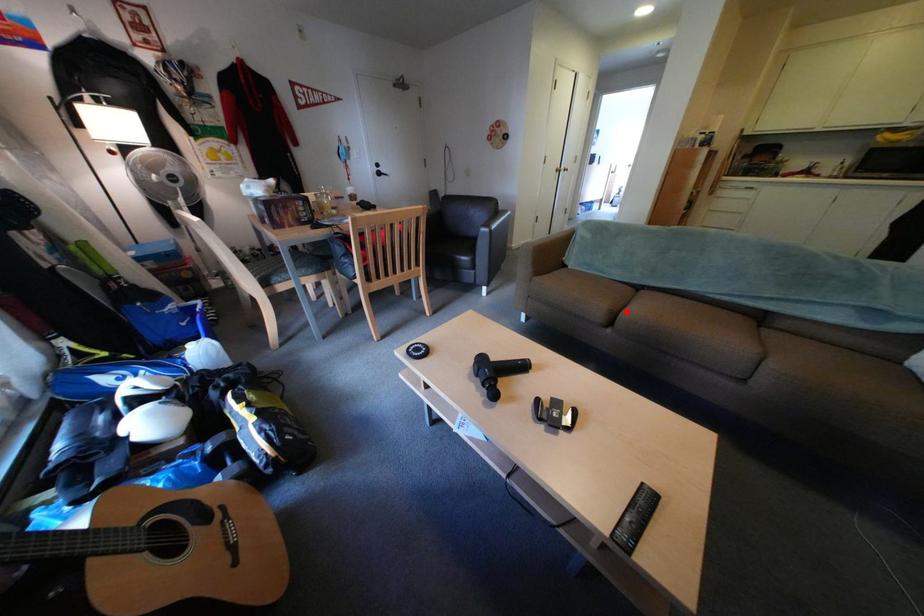
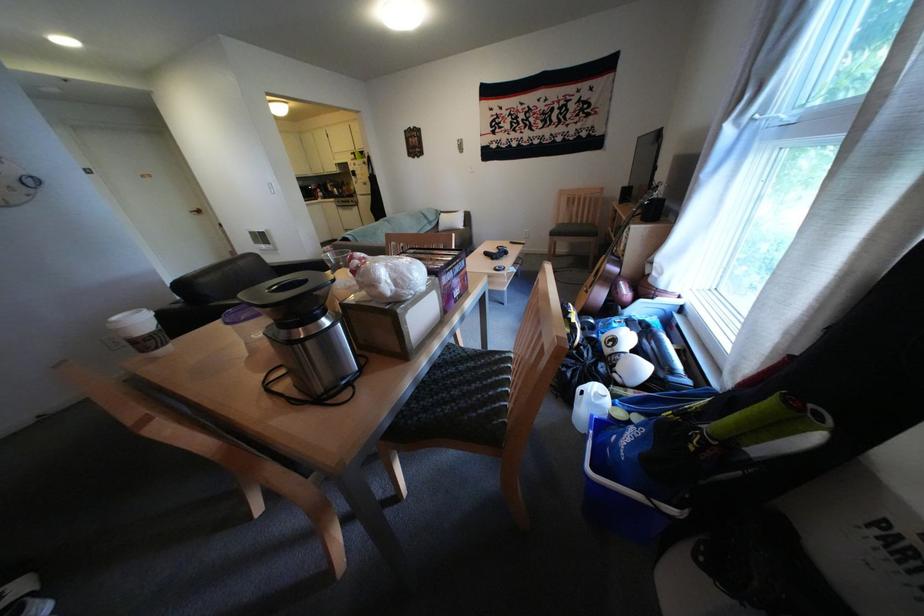
Question: I am providing you with two images of the same scene from different viewpoints. A red point is marked on the first image. Can you still see the location of the red point in image 2?

Choices:
 (A) Yes
 (B) No

Answer: (B)